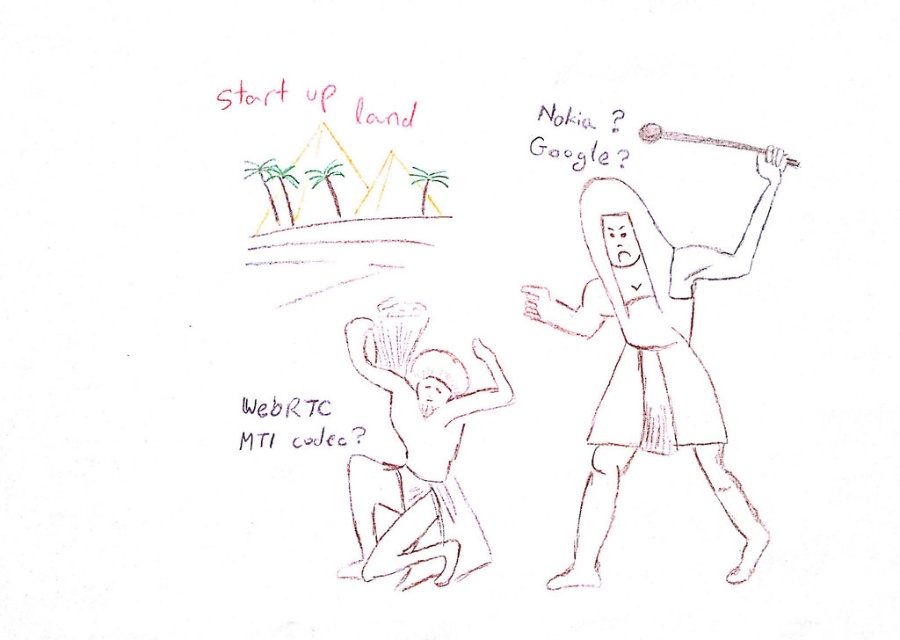
Question: Which of the following is the closest to the observer?

Choices:
 (A) (455, 554)
 (B) (626, 216)

Answer: (A)

Question: Among these objects, which one is farthest from the camera?

Choices:
 (A) smooth skin figure at lower left
 (B) smooth paper figure at right

Answer: (A)

Question: Observing the image, what is the correct spatial positioning of smooth paper figure at right in reference to smooth skin figure at lower left?

Choices:
 (A) left
 (B) right

Answer: (B)

Question: Among these objects, which one is farthest from the camera?

Choices:
 (A) smooth skin figure at lower left
 (B) smooth paper figure at right

Answer: (A)

Question: Considering the relative positions of smooth paper figure at right and smooth skin figure at lower left in the image provided, where is smooth paper figure at right located with respect to smooth skin figure at lower left?

Choices:
 (A) left
 (B) right

Answer: (B)

Question: Is smooth paper figure at right to the right of smooth skin figure at lower left from the viewer's perspective?

Choices:
 (A) no
 (B) yes

Answer: (B)